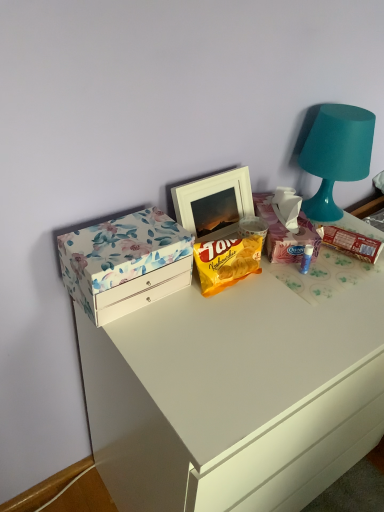
Question: From the image's perspective, is white glossy drawer at upper left positioned above or below yellow matte snack packet at center, which is counted as the second snack, starting from the right?

Choices:
 (A) above
 (B) below

Answer: (B)

Question: Do you think white glossy drawer at upper left is within yellow matte snack packet at center, which is counted as the second snack, starting from the right, or outside of it?

Choices:
 (A) outside
 (B) inside

Answer: (A)

Question: Which object is positioned farthest from the floral paper box at left?

Choices:
 (A) floral cardboard box at upper right
 (B) yellow matte snack packet at center, which is counted as the second snack, starting from the right
 (C) teal matte lamp at upper right
 (D) white glossy drawer at upper left
 (E) matte white picture frame at center

Answer: (C)

Question: Based on their relative distances, which object is farther from the teal matte lamp at upper right?

Choices:
 (A) white glossy drawer at upper left
 (B) floral cardboard box at upper right
 (C) matte white picture frame at center
 (D) yellow matte snack packet at center, the first snack when ordered from left to right
 (E) floral paper box at left

Answer: (E)